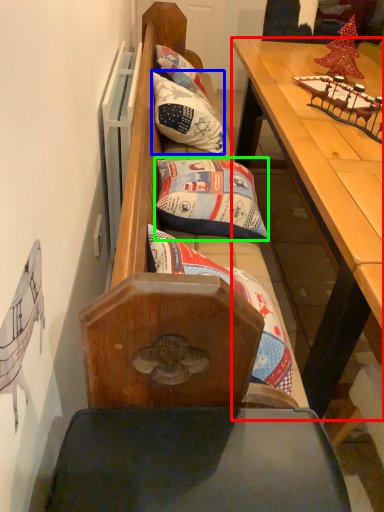
Question: Estimate the real-world distances between objects in this image. Which object is closer to table (highlighted by a red box), pillow (highlighted by a blue box) or pillow (highlighted by a green box)?

Choices:
 (A) pillow
 (B) pillow

Answer: (B)